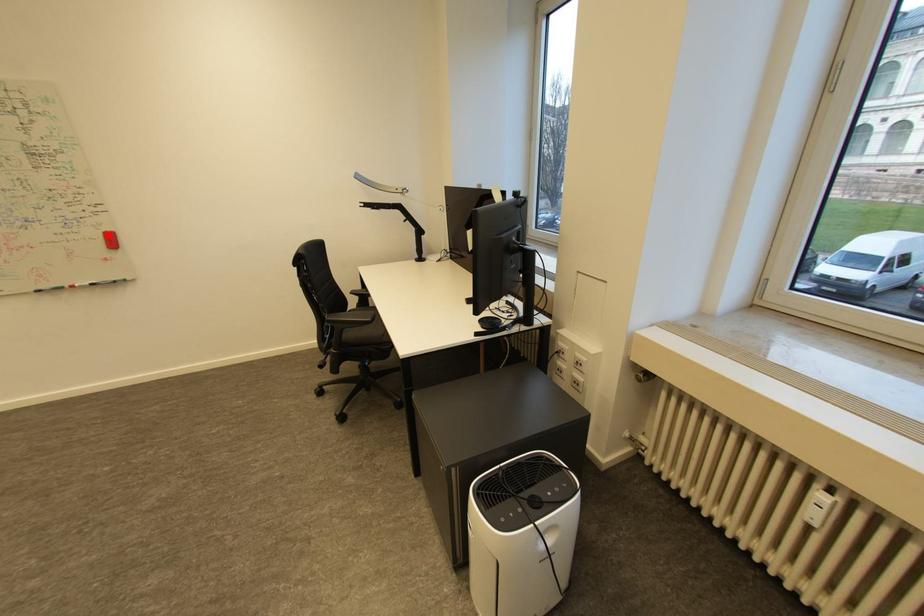
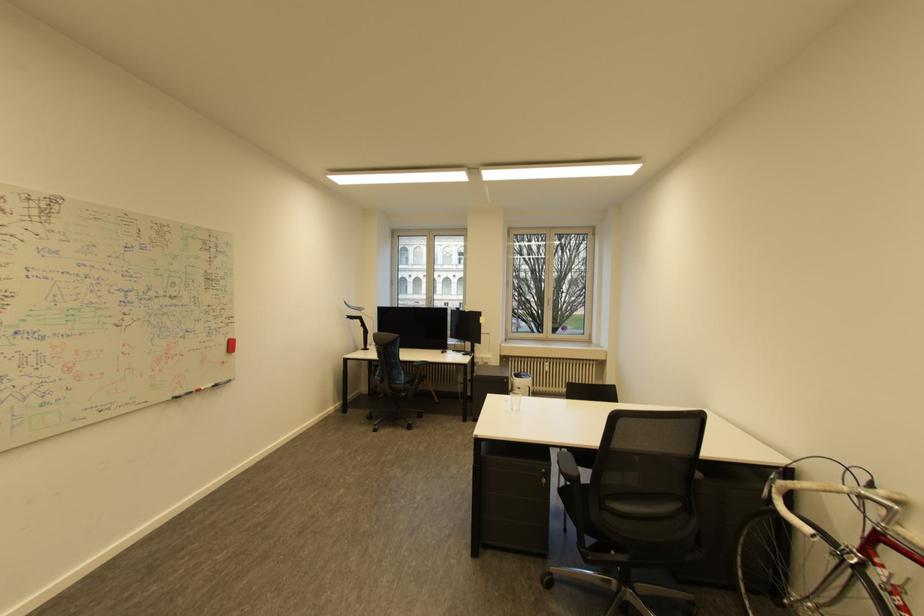
Find the pixel in the second image that matches the highlighted location in the first image.

(234, 342)